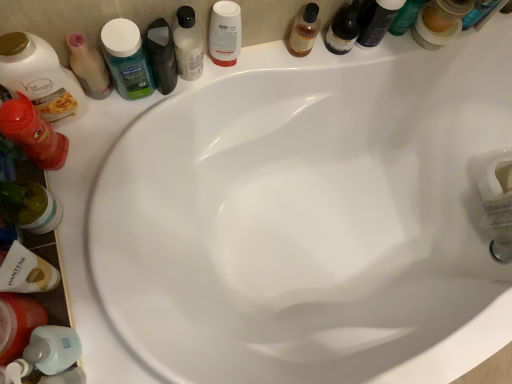
Question: Is there a large distance between green plastic mouthwash at upper left, which appears as the fourth mouthwash when viewed from the right, and white matte shampoo bottle at lower left, the 6th toiletry in the right-to-left sequence?

Choices:
 (A) yes
 (B) no

Answer: (B)

Question: Is green plastic mouthwash at upper left, which ranks as the fourth mouthwash in top-to-bottom order, next to white matte shampoo bottle at lower left, which appears as the 3th toiletry when viewed from the left?

Choices:
 (A) no
 (B) yes

Answer: (A)

Question: Can you confirm if green plastic mouthwash at upper left, positioned as the 3th mouthwash in left-to-right order, is wider than white matte shampoo bottle at lower left, which appears as the 3th toiletry when viewed from the left?

Choices:
 (A) no
 (B) yes

Answer: (B)

Question: Can you confirm if green plastic mouthwash at upper left, which appears as the fourth mouthwash when viewed from the right, is thinner than white matte shampoo bottle at lower left, the 6th toiletry in the right-to-left sequence?

Choices:
 (A) no
 (B) yes

Answer: (A)

Question: Is green plastic mouthwash at upper left, which appears as the third mouthwash when ordered from the bottom, aimed at white matte shampoo bottle at lower left, which appears as the 3th toiletry when viewed from the left?

Choices:
 (A) yes
 (B) no

Answer: (B)

Question: From the image's perspective, is green plastic mouthwash at upper left, which appears as the third mouthwash when ordered from the bottom, located above white matte shampoo bottle at lower left, the 6th toiletry in the right-to-left sequence?

Choices:
 (A) no
 (B) yes

Answer: (B)

Question: Does translucent plastic mouthwash at lower left, the 1th mouthwash viewed from the left, have a lesser height compared to translucent plastic mouthwash at left, arranged as the 5th mouthwash when viewed from the top?

Choices:
 (A) no
 (B) yes

Answer: (A)

Question: Is translucent plastic mouthwash at lower left, the first mouthwash ordered from the bottom, facing towards translucent plastic mouthwash at left, placed as the second mouthwash when sorted from bottom to top?

Choices:
 (A) no
 (B) yes

Answer: (A)

Question: From a real-world perspective, does translucent plastic mouthwash at lower left, the 1th mouthwash viewed from the left, stand above translucent plastic mouthwash at left, positioned as the second mouthwash in left-to-right order?

Choices:
 (A) yes
 (B) no

Answer: (A)

Question: From the image's perspective, is translucent plastic mouthwash at lower left, which is the 6th mouthwash in top-to-bottom order, located above translucent plastic mouthwash at left, positioned as the second mouthwash in left-to-right order?

Choices:
 (A) no
 (B) yes

Answer: (A)

Question: From the image's perspective, is translucent plastic mouthwash at lower left, placed as the sixth mouthwash when sorted from right to left, beneath translucent plastic mouthwash at left, the fifth mouthwash when ordered from right to left?

Choices:
 (A) yes
 (B) no

Answer: (A)

Question: Can you confirm if translucent plastic mouthwash at lower left, which is the 6th mouthwash in top-to-bottom order, is thinner than translucent plastic mouthwash at left, arranged as the 5th mouthwash when viewed from the top?

Choices:
 (A) no
 (B) yes

Answer: (A)

Question: Is matte black bottle at upper right, the 1th toiletry positioned from the right, to the right of translucent plastic mouthwash at lower left, the 1th mouthwash viewed from the left, from the viewer's perspective?

Choices:
 (A) no
 (B) yes

Answer: (B)